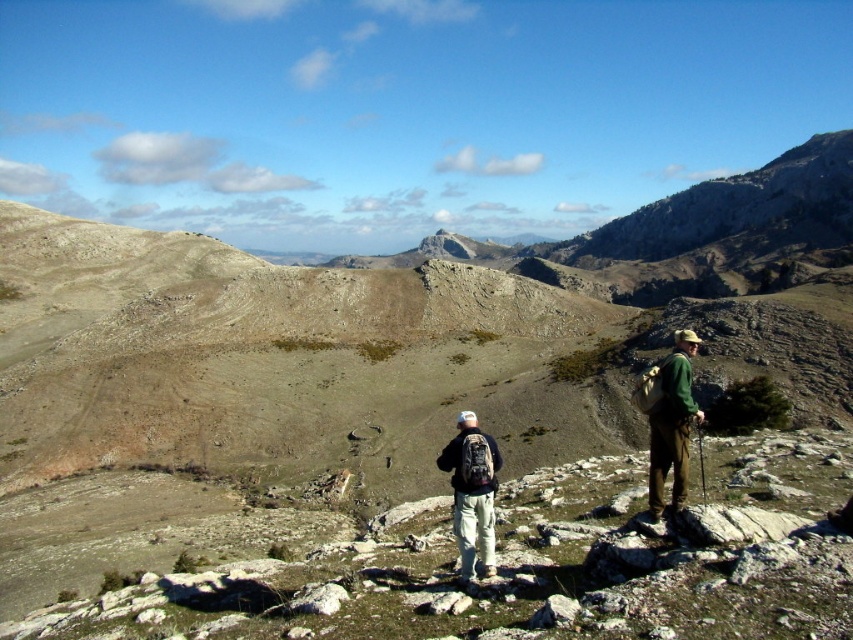
Question: Is green fabric backpack at right further to camera compared to dark gray backpack at center?

Choices:
 (A) no
 (B) yes

Answer: (B)

Question: Is green fabric backpack at right closer to the viewer compared to dark gray backpack at center?

Choices:
 (A) no
 (B) yes

Answer: (A)

Question: Can you confirm if green fabric backpack at right is positioned to the right of dark gray backpack at center?

Choices:
 (A) no
 (B) yes

Answer: (B)

Question: Which object is farther from the camera taking this photo?

Choices:
 (A) green fabric backpack at right
 (B) dark gray backpack at center

Answer: (A)

Question: Among these points, which one is farthest from the camera?

Choices:
 (A) (463, 420)
 (B) (683, 372)

Answer: (A)